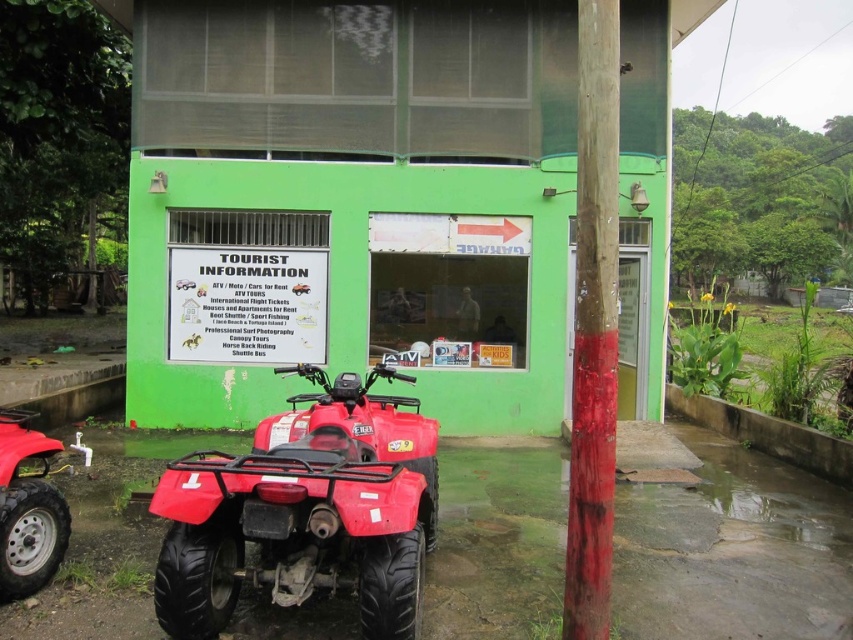
Which of these two, shiny red quad bike at lower left or smooth wooden pole at right, stands taller?

With more height is smooth wooden pole at right.

The image size is (853, 640). What are the coordinates of `shiny red quad bike at lower left` in the screenshot? It's located at (305, 509).